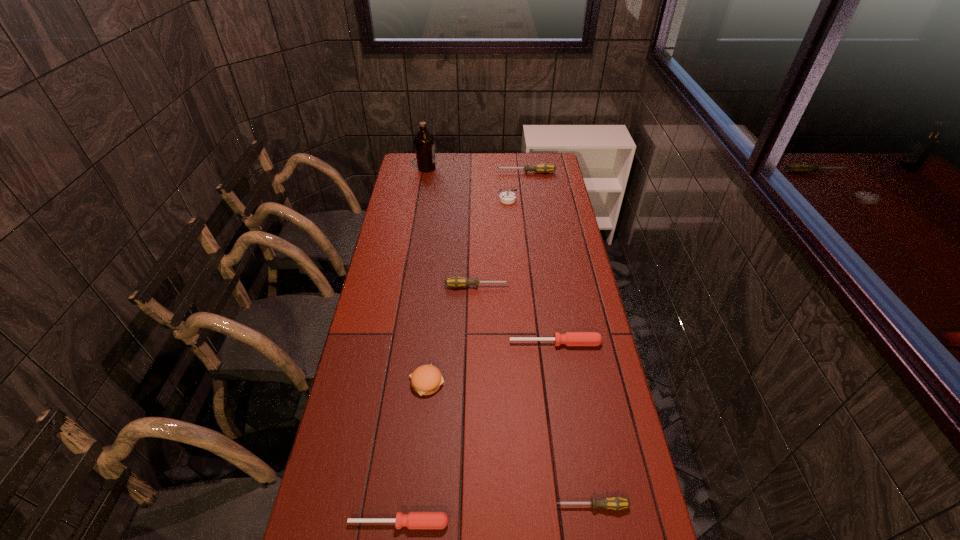
The width and height of the screenshot is (960, 540). Identify the location of vacant point located between the farthest gray screwdriver and the nearer red screwdriver. (462, 348).

This screenshot has width=960, height=540. Find the location of `free space that is in between the sixth nearest object and the fifth nearest object`. free space that is in between the sixth nearest object and the fifth nearest object is located at coordinates (492, 243).

The width and height of the screenshot is (960, 540). Find the location of `vacant region between the third nearest object and the right red screwdriver`. vacant region between the third nearest object and the right red screwdriver is located at coordinates (492, 362).

Locate an element on the screen. The image size is (960, 540). vacant space that's between the smaller red screwdriver and the second nearest object is located at coordinates (495, 514).

Find the location of a particular element. object that is the fifth closest to the farthest screwdriver is located at coordinates (426, 379).

Locate which object is the fifth closest to the third farthest object. Please provide its 2D coordinates. Your answer should be formatted as a tuple, i.e. [(x, y)], where the tuple contains the x and y coordinates of a point satisfying the conditions above.

[(426, 379)]

Locate which screwdriver ranks second in proximity to the olive oil. Please provide its 2D coordinates. Your answer should be formatted as a tuple, i.e. [(x, y)], where the tuple contains the x and y coordinates of a point satisfying the conditions above.

[(456, 281)]

Where is `the second closest screwdriver to the smallest gray screwdriver`? the second closest screwdriver to the smallest gray screwdriver is located at coordinates (569, 338).

Locate which gray screwdriver is the second closest to the third farthest object. Please provide its 2D coordinates. Your answer should be formatted as a tuple, i.e. [(x, y)], where the tuple contains the x and y coordinates of a point satisfying the conditions above.

[(456, 281)]

Locate which gray screwdriver is the closest to the second nearest object. Please provide its 2D coordinates. Your answer should be formatted as a tuple, i.e. [(x, y)], where the tuple contains the x and y coordinates of a point satisfying the conditions above.

[(456, 281)]